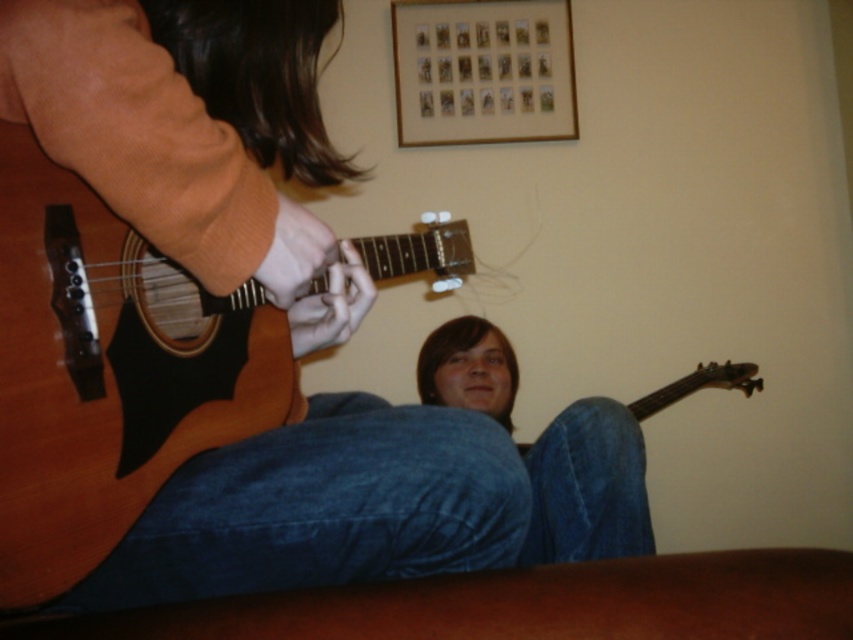
You are a small drone that is 1.5 feet wide. You want to fly from the blue denim jeans at lower center to the wooden frame at upper center. Is there enough space between them for you to pass through?

The distance between blue denim jeans at lower center and wooden frame at upper center is 4.27 feet, which is greater than the drone width of 1.5 feet. Yes, the drone can pass through the space between them.

You are a photographer trying to capture a clear shot of the wooden acoustic guitar at left without the wooden frame at upper center blocking it. Based on the scene, can you position yourself in a way to achieve this?

Yes, because the wooden acoustic guitar at left is in front of the wooden frame at upper center, you can position yourself so that the guitar is between you and the frame, ensuring the frame does not block the view of the guitar.